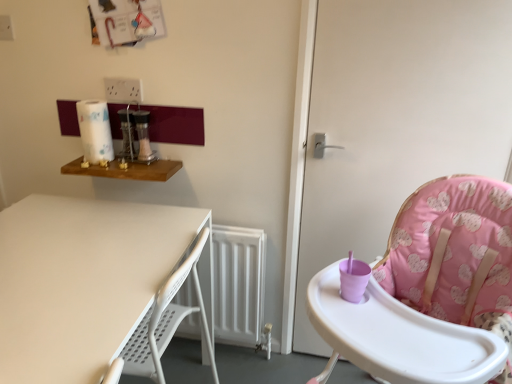
Identify the location of spots to the right of white paper towel at upper left. point(138,163).